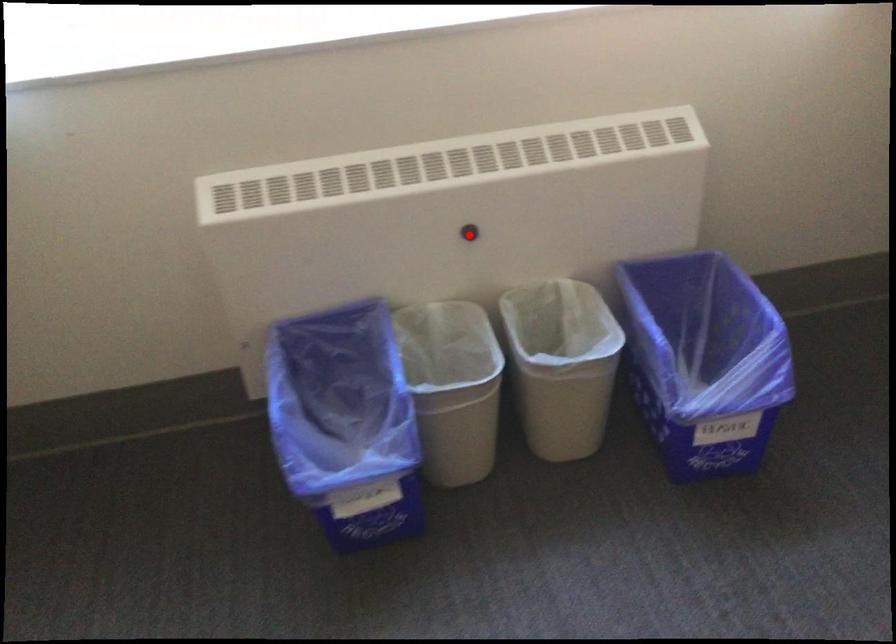
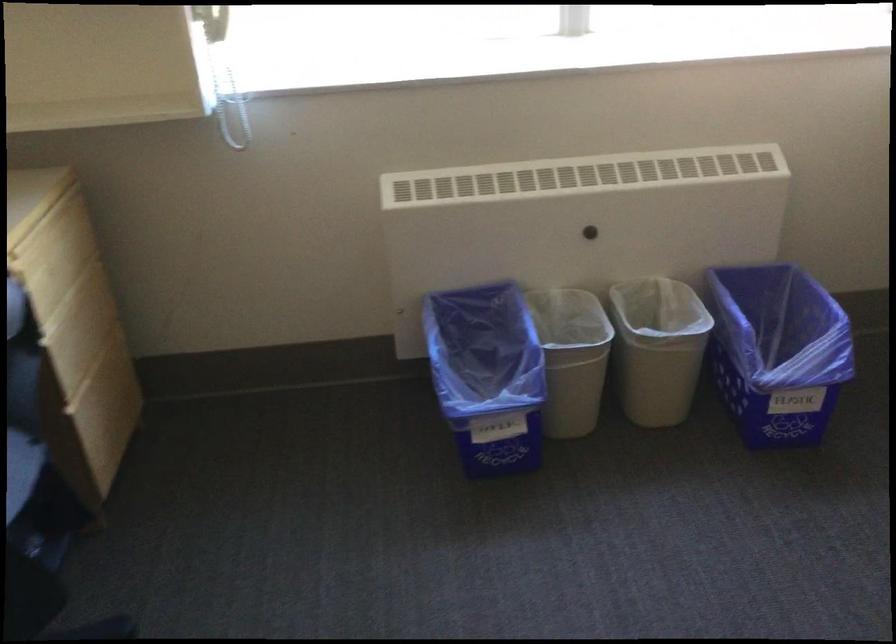
Question: A red point is marked in image1. In image2, is the corresponding 3D point closer to the camera or farther? Reply with the corresponding letter.

Choices:
 (A) The corresponding 3D point is closer.
 (B) The corresponding 3D point is farther.

Answer: (B)